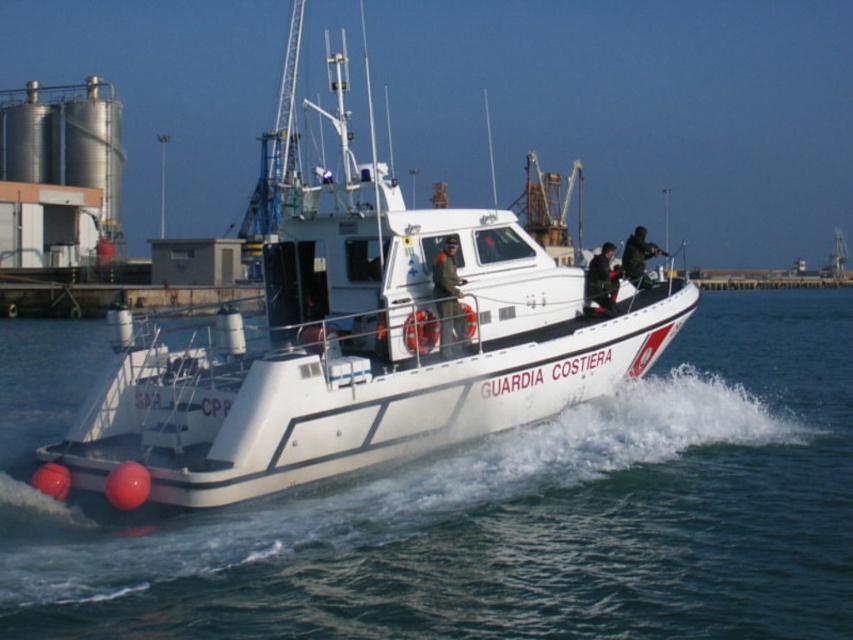
Can you confirm if white water at center is taller than white matte boat at center?

Incorrect, white water at center's height is not larger of white matte boat at center's.

Does white water at center have a larger size compared to white matte boat at center?

No, white water at center is not bigger than white matte boat at center.

Who is more distant from viewer, (x=59, y=557) or (x=131, y=422)?

Point (x=131, y=422)

At what (x,y) coordinates should I click in order to perform the action: click on white water at center. Please return your answer as a coordinate pair (x, y). Looking at the image, I should click on (486, 509).